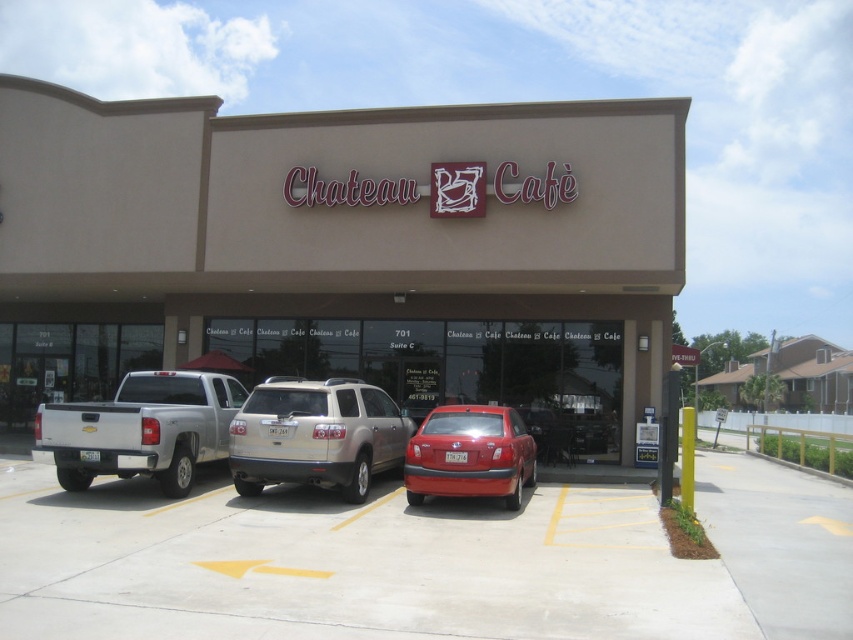
Does concrete parking lot at center appear on the right side of satin silver suv at center?

No, concrete parking lot at center is not to the right of satin silver suv at center.

Can you confirm if concrete parking lot at center is taller than satin silver suv at center?

No.

The width and height of the screenshot is (853, 640). In order to click on concrete parking lot at center in this screenshot , I will do `click(427, 561)`.

Can you confirm if beige/smooth building at center is thinner than satin silver suv at center?

In fact, beige/smooth building at center might be wider than satin silver suv at center.

Which is more to the right, beige/smooth building at center or satin silver suv at center?

satin silver suv at center is more to the right.

Is point (358, 227) closer to viewer compared to point (277, 417)?

No, it is not.

Find the location of a particular element. The height and width of the screenshot is (640, 853). beige/smooth building at center is located at coordinates (347, 250).

From the picture: Can you confirm if beige/smooth building at center is wider than shiny red sedan at center?

Indeed, beige/smooth building at center has a greater width compared to shiny red sedan at center.

Between beige/smooth building at center and shiny red sedan at center, which one appears on the left side from the viewer's perspective?

From the viewer's perspective, beige/smooth building at center appears more on the left side.

Who is more forward, (28, 288) or (496, 488)?

Positioned in front is point (496, 488).

I want to click on beige/smooth building at center, so click(347, 250).